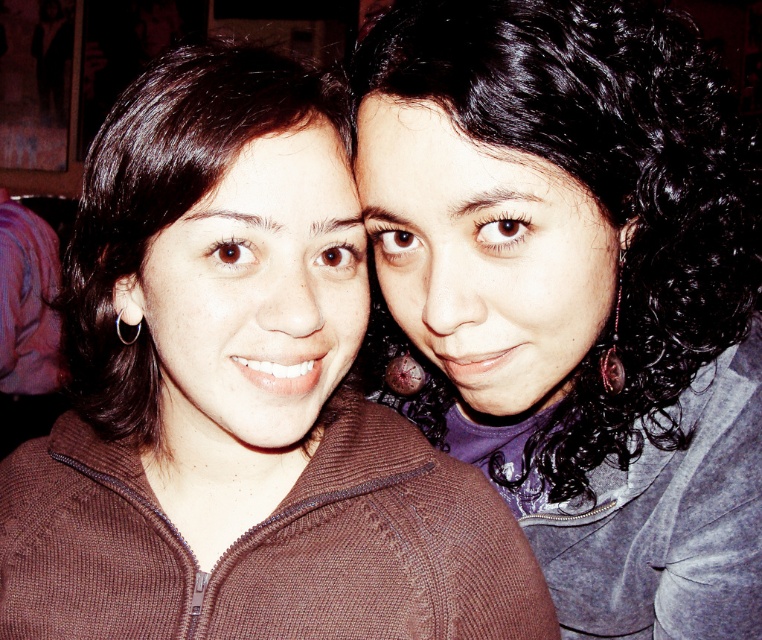
Is brown knitted sweater at center bigger than black curly hair at upper right?

Actually, brown knitted sweater at center might be smaller than black curly hair at upper right.

Is brown knitted sweater at center shorter than black curly hair at upper right?

Incorrect, brown knitted sweater at center's height does not fall short of black curly hair at upper right's.

Between point (357, 588) and point (684, 224), which one is positioned behind?

The point (684, 224) is behind.

At what (x,y) coordinates should I click in order to perform the action: click on brown knitted sweater at center. Please return your answer as a coordinate pair (x, y). The image size is (762, 640). Looking at the image, I should click on (239, 397).

Can you confirm if brown knitted sweater at center is thinner than brown smooth hair at left?

No.

This screenshot has width=762, height=640. What do you see at coordinates (239, 397) in the screenshot? I see `brown knitted sweater at center` at bounding box center [239, 397].

Locate an element on the screen. This screenshot has width=762, height=640. brown knitted sweater at center is located at coordinates (239, 397).

In the scene shown: Does black curly hair at upper right have a lesser width compared to brown smooth hair at left?

In fact, black curly hair at upper right might be wider than brown smooth hair at left.

Where is `black curly hair at upper right`? The image size is (762, 640). black curly hair at upper right is located at coordinates (604, 188).